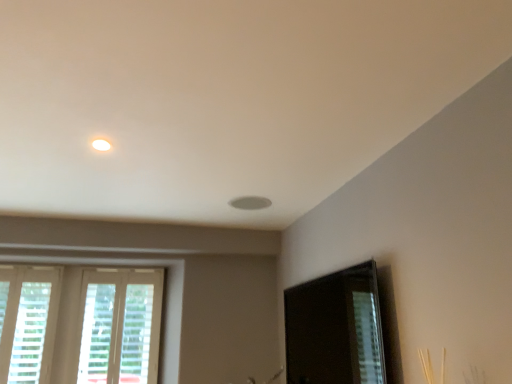
Question: Can white wooden window at lower left, which ranks as the first window in right-to-left order, be found inside white textured blinds at lower left, which appears as the 1th window when viewed from the left?

Choices:
 (A) yes
 (B) no

Answer: (B)

Question: From the image's perspective, is white textured blinds at lower left, which appears as the 1th window when viewed from the left, above white wooden window at lower left, which ranks as the first window in right-to-left order?

Choices:
 (A) yes
 (B) no

Answer: (A)

Question: Is white textured blinds at lower left, which appears as the 1th window when viewed from the left, outside of white wooden window at lower left, which ranks as the first window in right-to-left order?

Choices:
 (A) yes
 (B) no

Answer: (A)

Question: From a real-world perspective, does white textured blinds at lower left, which appears as the 1th window when viewed from the left, stand above white wooden window at lower left, the second window when ordered from left to right?

Choices:
 (A) yes
 (B) no

Answer: (A)

Question: Is white textured blinds at lower left, the second window when ordered from right to left, positioned in front of white wooden window at lower left, which ranks as the first window in right-to-left order?

Choices:
 (A) yes
 (B) no

Answer: (A)

Question: Is white textured blinds at lower left, the second window when ordered from right to left, turned away from white wooden window at lower left, which ranks as the first window in right-to-left order?

Choices:
 (A) no
 (B) yes

Answer: (A)

Question: Considering the relative positions of transparent glass screen door at lower right and white textured blinds at lower left, which appears as the 1th window when viewed from the left, in the image provided, is transparent glass screen door at lower right to the right of white textured blinds at lower left, which appears as the 1th window when viewed from the left, from the viewer's perspective?

Choices:
 (A) yes
 (B) no

Answer: (A)

Question: Does transparent glass screen door at lower right have a lesser width compared to white textured blinds at lower left, which appears as the 1th window when viewed from the left?

Choices:
 (A) yes
 (B) no

Answer: (B)

Question: Is transparent glass screen door at lower right closer to camera compared to white textured blinds at lower left, which appears as the 1th window when viewed from the left?

Choices:
 (A) yes
 (B) no

Answer: (A)

Question: Is transparent glass screen door at lower right at the left side of white textured blinds at lower left, which appears as the 1th window when viewed from the left?

Choices:
 (A) yes
 (B) no

Answer: (B)

Question: Can you confirm if transparent glass screen door at lower right is bigger than white textured blinds at lower left, which appears as the 1th window when viewed from the left?

Choices:
 (A) no
 (B) yes

Answer: (B)

Question: Would you say transparent glass screen door at lower right is outside white textured blinds at lower left, which appears as the 1th window when viewed from the left?

Choices:
 (A) no
 (B) yes

Answer: (B)

Question: From a real-world perspective, does white wooden window at lower left, which ranks as the first window in right-to-left order, sit lower than transparent glass screen door at lower right?

Choices:
 (A) no
 (B) yes

Answer: (A)